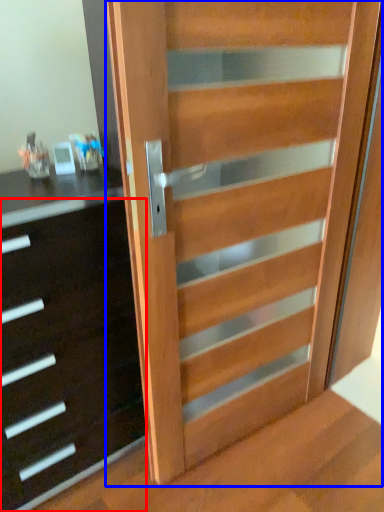
Question: Which of the following is the farthest to the observer, chest of drawers (highlighted by a red box) or door (highlighted by a blue box)?

Choices:
 (A) chest of drawers
 (B) door

Answer: (A)